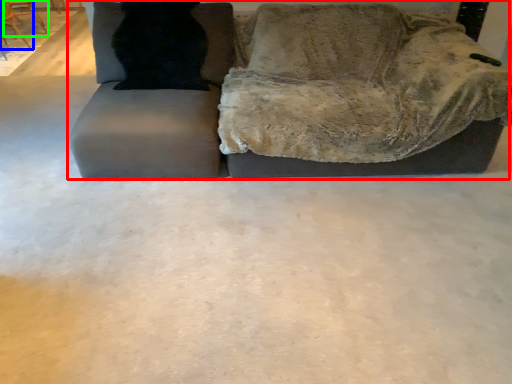
Question: Which object is the farthest from studio couch (highlighted by a red box)? Choose among these: chair (highlighted by a blue box) or chair (highlighted by a green box).

Choices:
 (A) chair
 (B) chair

Answer: (B)